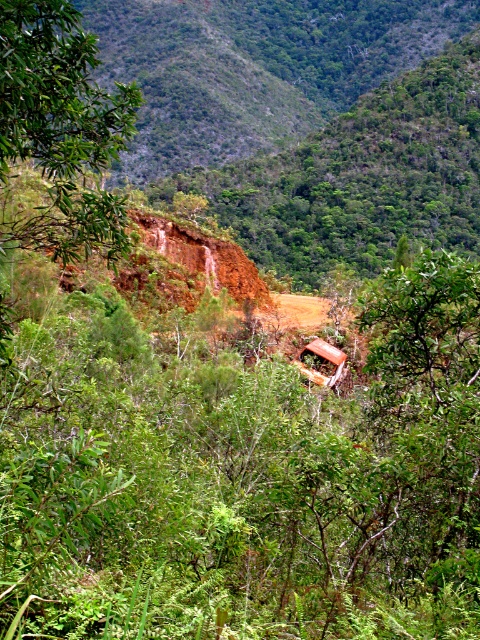
Question: Does green leafy tree at left appear on the left side of rusty metal jeep at center?

Choices:
 (A) yes
 (B) no

Answer: (A)

Question: Among these points, which one is nearest to the camera?

Choices:
 (A) (305, 356)
 (B) (16, 61)

Answer: (B)

Question: From the image, what is the correct spatial relationship of green leafy tree at left in relation to rusty metal jeep at center?

Choices:
 (A) below
 (B) above

Answer: (B)

Question: Which point is closer to the camera taking this photo?

Choices:
 (A) (22, 157)
 (B) (301, 364)

Answer: (A)

Question: Can you confirm if green leafy tree at left is positioned to the right of rusty metal jeep at center?

Choices:
 (A) no
 (B) yes

Answer: (A)